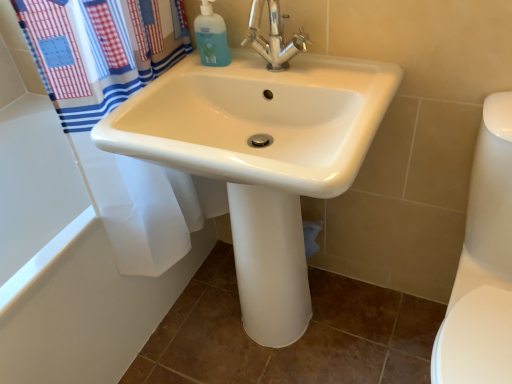
Image resolution: width=512 pixels, height=384 pixels. Describe the element at coordinates (211, 37) in the screenshot. I see `translucent plastic bottle at upper center` at that location.

Where is `white glossy sink at center`? The height and width of the screenshot is (384, 512). white glossy sink at center is located at coordinates (261, 158).

From the picture: From a real-world perspective, is white glossy bathtub at lower left physically located above or below white glossy toilet bowl at right?

Answer: white glossy bathtub at lower left is situated lower than white glossy toilet bowl at right in the real world.

Which is more to the right, white glossy bathtub at lower left or white glossy toilet bowl at right?

From the viewer's perspective, white glossy toilet bowl at right appears more on the right side.

Which object is closer to the camera taking this photo, white glossy bathtub at lower left or white glossy toilet bowl at right?

white glossy toilet bowl at right is closer to the camera.

Find the location of a particular element. toilet bowl in front of the white glossy bathtub at lower left is located at coordinates (483, 264).

Is white glossy toilet bowl at right oriented away from white glossy sink at center?

No, white glossy sink at center is not at the back of white glossy toilet bowl at right.

From the image's perspective, which one is positioned higher, white glossy toilet bowl at right or white glossy sink at center?

white glossy sink at center is shown above in the image.

Does point (502, 347) come farther from viewer compared to point (179, 112)?

That is False.

Is white glossy toilet bowl at right far from white glossy sink at center?

They are positioned close to each other.

Do you think polished chrome faucet at center is within white glossy bathtub at lower left, or outside of it?

polished chrome faucet at center cannot be found inside white glossy bathtub at lower left.

Based on the photo, in the image, is polished chrome faucet at center positioned in front of or behind white glossy bathtub at lower left?

Clearly, polished chrome faucet at center is in front of white glossy bathtub at lower left.

From a real-world perspective, is polished chrome faucet at center over white glossy bathtub at lower left?

Correct, in the physical world, polished chrome faucet at center is higher than white glossy bathtub at lower left.

Does white glossy toilet bowl at right contain polished chrome faucet at center?

No, polished chrome faucet at center is not a part of white glossy toilet bowl at right.

Does white glossy toilet bowl at right have a greater width compared to polished chrome faucet at center?

Indeed, white glossy toilet bowl at right has a greater width compared to polished chrome faucet at center.

Considering the relative positions of white glossy toilet bowl at right and polished chrome faucet at center in the image provided, is white glossy toilet bowl at right to the left or to the right of polished chrome faucet at center?

From the image, it's evident that white glossy toilet bowl at right is to the right of polished chrome faucet at center.

Is white glossy toilet bowl at right looking in the opposite direction of polished chrome faucet at center?

No.

Locate an element on the screen. This screenshot has height=384, width=512. cleaning product on the right of white glossy bathtub at lower left is located at coordinates (211, 37).

Based on the photo, how distant is white glossy bathtub at lower left from translucent plastic bottle at upper center?

white glossy bathtub at lower left and translucent plastic bottle at upper center are 27.19 inches apart.

From a real-world perspective, is white glossy bathtub at lower left beneath translucent plastic bottle at upper center?

Yes, from a real-world perspective, white glossy bathtub at lower left is below translucent plastic bottle at upper center.

Is white glossy bathtub at lower left bigger or smaller than translucent plastic bottle at upper center?

white glossy bathtub at lower left is bigger than translucent plastic bottle at upper center.

Is point (212, 57) closer to viewer compared to point (288, 54)?

No, it is not.

From a real-world perspective, between translucent plastic bottle at upper center and polished chrome faucet at center, who is vertically lower?

translucent plastic bottle at upper center.

Are translucent plastic bottle at upper center and polished chrome faucet at center located far from each other?

That's not correct — translucent plastic bottle at upper center is a little close to polished chrome faucet at center.

Is polished chrome faucet at center situated inside white glossy toilet bowl at right or outside?

polished chrome faucet at center is not inside white glossy toilet bowl at right, it's outside.

From the image's perspective, who appears lower, polished chrome faucet at center or white glossy toilet bowl at right?

white glossy toilet bowl at right, from the image's perspective.

In terms of size, does polished chrome faucet at center appear bigger or smaller than white glossy toilet bowl at right?

polished chrome faucet at center is smaller than white glossy toilet bowl at right.

Between polished chrome faucet at center and white glossy toilet bowl at right, which one appears on the left side from the viewer's perspective?

polished chrome faucet at center is more to the left.

This screenshot has width=512, height=384. In order to click on bath that appears behind the white glossy toilet bowl at right in this screenshot , I will do `click(67, 264)`.

What are the coordinates of `toilet bowl that is under the white glossy sink at center (from a real-world perspective)` in the screenshot? It's located at (483, 264).

Which object lies further to the anchor point white glossy toilet bowl at right, polished chrome faucet at center or white glossy sink at center?

Among the two, polished chrome faucet at center is located further to white glossy toilet bowl at right.

Estimate the real-world distances between objects in this image. Which object is closer to white glossy sink at center, polished chrome faucet at center or white glossy bathtub at lower left?

polished chrome faucet at center is closer to white glossy sink at center.

Considering their positions, is white glossy toilet bowl at right positioned closer to polished chrome faucet at center than translucent plastic bottle at upper center?

translucent plastic bottle at upper center lies closer to polished chrome faucet at center than the other object.

Estimate the real-world distances between objects in this image. Which object is further from white glossy toilet bowl at right, white glossy sink at center or translucent plastic bottle at upper center?

translucent plastic bottle at upper center lies further to white glossy toilet bowl at right than the other object.

Looking at the image, which one is located closer to translucent plastic bottle at upper center, polished chrome faucet at center or white glossy toilet bowl at right?

polished chrome faucet at center lies closer to translucent plastic bottle at upper center than the other object.

Which object lies nearer to the anchor point polished chrome faucet at center, white glossy bathtub at lower left or translucent plastic bottle at upper center?

translucent plastic bottle at upper center is closer to polished chrome faucet at center.

Estimate the real-world distances between objects in this image. Which object is further from polished chrome faucet at center, translucent plastic bottle at upper center or white glossy bathtub at lower left?

Among the two, white glossy bathtub at lower left is located further to polished chrome faucet at center.

Based on their spatial positions, is white glossy sink at center or white glossy bathtub at lower left further from translucent plastic bottle at upper center?

Based on the image, white glossy bathtub at lower left appears to be further to translucent plastic bottle at upper center.

Locate an element on the screen. Image resolution: width=512 pixels, height=384 pixels. sink situated between white glossy bathtub at lower left and white glossy toilet bowl at right from left to right is located at coordinates (261, 158).

Locate an element on the screen. The width and height of the screenshot is (512, 384). sink between polished chrome faucet at center and white glossy toilet bowl at right from top to bottom is located at coordinates (261, 158).

Image resolution: width=512 pixels, height=384 pixels. I want to click on tap between translucent plastic bottle at upper center and white glossy toilet bowl at right in the up-down direction, so click(273, 37).

In order to click on cleaning product between white glossy bathtub at lower left and polished chrome faucet at center in this screenshot , I will do `click(211, 37)`.